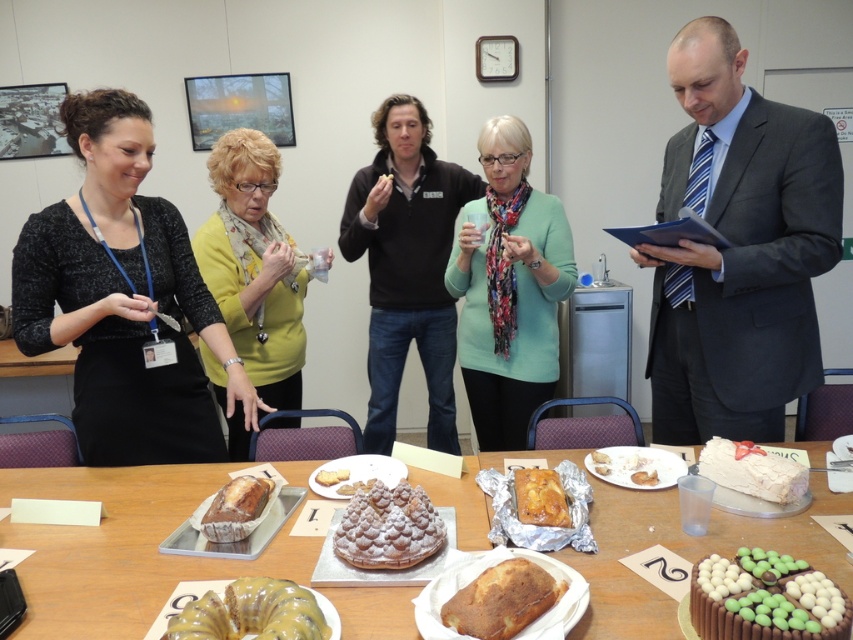
Which is more to the left, black textured sweater at center or green matte sweater at center?

black textured sweater at center

Between point (96, 320) and point (560, 280), which one is positioned behind?

The point (560, 280) is more distant.

Where is `black textured sweater at center`? The width and height of the screenshot is (853, 640). black textured sweater at center is located at coordinates (123, 300).

Who is positioned more to the left, chocolate frosted cake with chocolate candies at center or yellow sponge cake at center?

yellow sponge cake at center is more to the left.

Who is higher up, chocolate frosted cake with chocolate candies at center or yellow sponge cake at center?

chocolate frosted cake with chocolate candies at center is above.

Is point (698, 620) positioned after point (517, 625)?

No, (698, 620) is closer to viewer.

Find the location of a particular element. chocolate frosted cake with chocolate candies at center is located at coordinates (764, 604).

Is point (97, 541) more distant than point (181, 620)?

Yes, it is.

Does golden brown cake at center lie in front of glossy yellow cake at center?

No, it is behind glossy yellow cake at center.

This screenshot has height=640, width=853. Describe the element at coordinates (123, 547) in the screenshot. I see `golden brown cake at center` at that location.

The height and width of the screenshot is (640, 853). I want to click on golden brown cake at center, so click(123, 547).